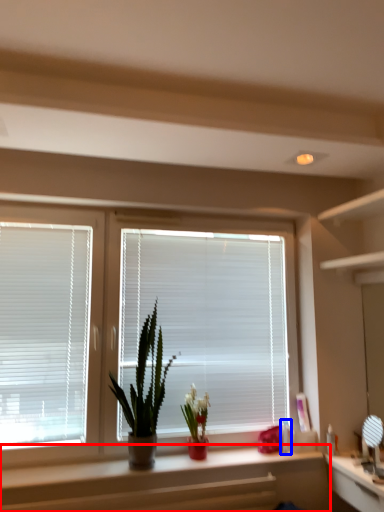
Question: Among these objects, which one is farthest to the camera, counter (highlighted by a red box) or toiletry (highlighted by a blue box)?

Choices:
 (A) counter
 (B) toiletry

Answer: (B)